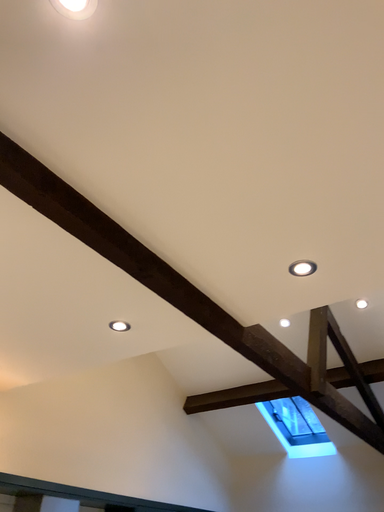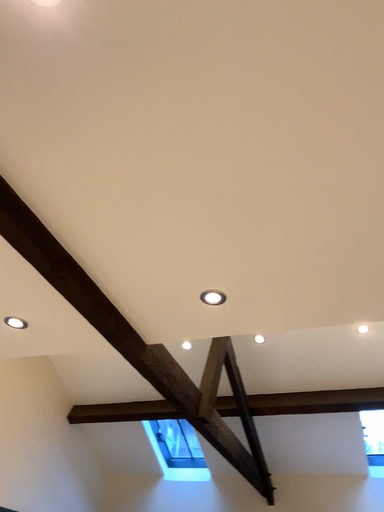
Question: How did the camera likely rotate when shooting the video?

Choices:
 (A) rotated right
 (B) rotated left

Answer: (A)